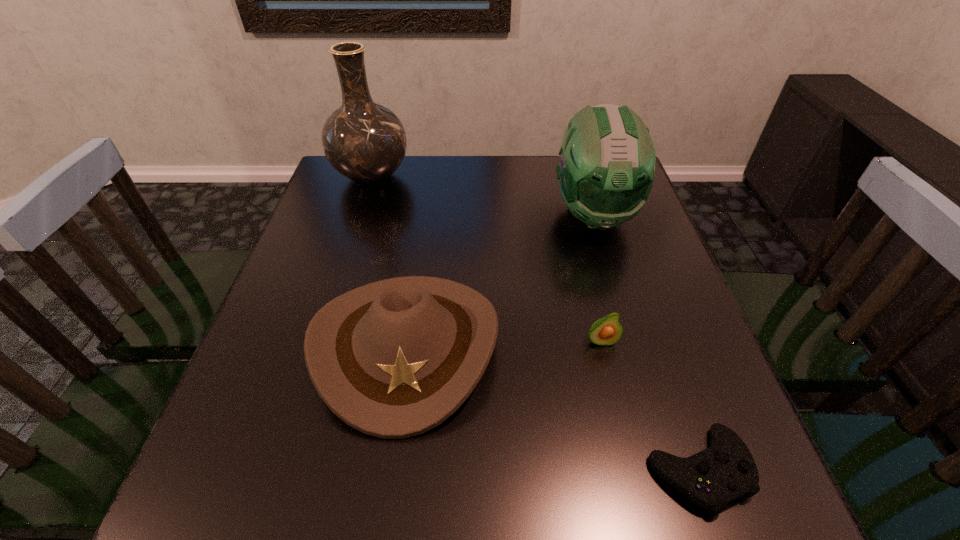
This screenshot has width=960, height=540. In the image, there is a desktop. What are the coordinates of `vacant space at the near edge` in the screenshot? It's located at (628, 517).

In the image, there is a desktop. Identify the location of vacant area at the left edge. (284, 328).

Identify the location of free space at the right edge of the desktop. (700, 385).

Identify the location of free space between the second tallest object and the cowboy hat. pyautogui.click(x=500, y=280).

This screenshot has width=960, height=540. In order to click on vacant region between the third shortest object and the fourth tallest object in this screenshot , I will do `click(504, 343)`.

Where is `free space between the cowboy hat and the vase`? The height and width of the screenshot is (540, 960). free space between the cowboy hat and the vase is located at coordinates (390, 261).

Identify the location of free space between the second shortest object and the tallest object. (487, 259).

Where is `vacant area that lies between the football helmet and the cowboy hat`? The height and width of the screenshot is (540, 960). vacant area that lies between the football helmet and the cowboy hat is located at coordinates (500, 280).

Image resolution: width=960 pixels, height=540 pixels. I want to click on vacant area that lies between the cowboy hat and the fourth tallest object, so click(x=504, y=343).

Where is `free point between the football helmet and the second shortest object`? The width and height of the screenshot is (960, 540). free point between the football helmet and the second shortest object is located at coordinates (597, 278).